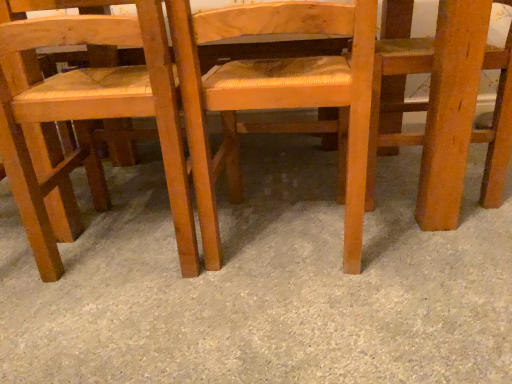
Question: Is wooden woven seat at left, which ranks as the first chair in left-to-right order, spatially inside wooden chair at right, the 1th chair positioned from the right, or outside of it?

Choices:
 (A) outside
 (B) inside

Answer: (A)

Question: Looking at their shapes, would you say wooden woven seat at left, which ranks as the first chair in left-to-right order, is wider or thinner than wooden chair at right, arranged as the 3th chair when viewed from the left?

Choices:
 (A) thin
 (B) wide

Answer: (B)

Question: Estimate the real-world distances between objects in this image. Which object is farther from the wooden chair at right, the 1th chair positioned from the right?

Choices:
 (A) gray carpet at center
 (B) wooden woven seat at left, the 3th chair in the right-to-left sequence
 (C) wooden chair at center, the 2th chair viewed from the right

Answer: (B)

Question: Based on their relative distances, which object is nearer to the wooden woven seat at left, which ranks as the first chair in left-to-right order?

Choices:
 (A) wooden chair at center, the 2th chair viewed from the right
 (B) wooden chair at right, arranged as the 3th chair when viewed from the left
 (C) gray carpet at center

Answer: (A)